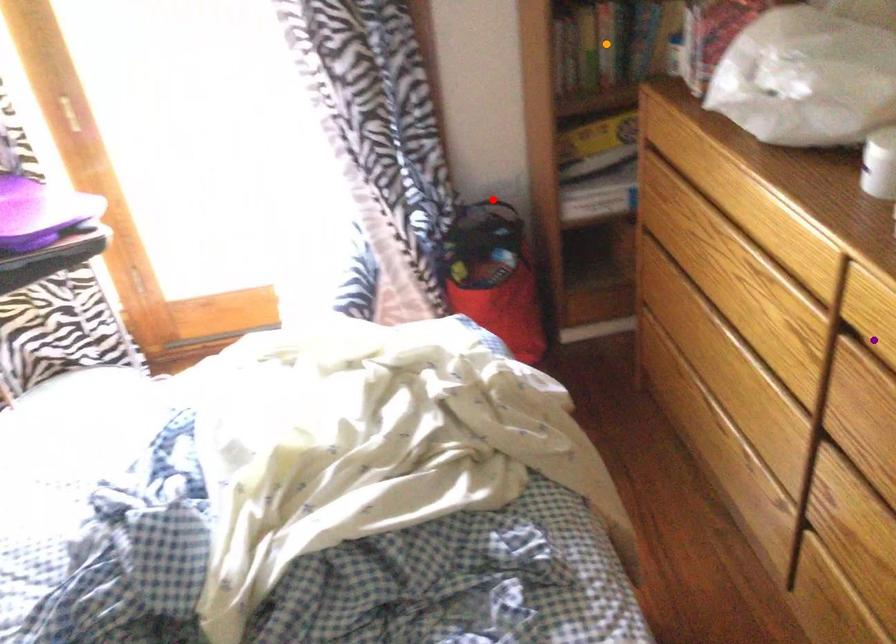
Order these from nearest to farthest:
1. purple point
2. orange point
3. red point

1. purple point
2. orange point
3. red point